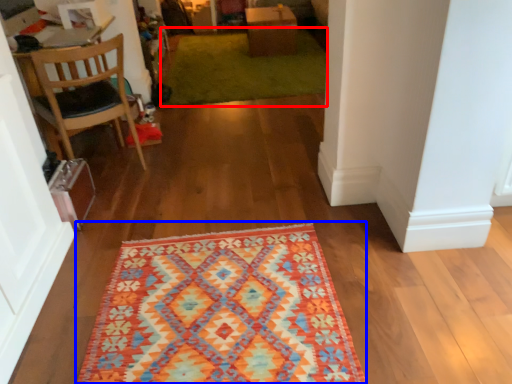
Question: Which object is further to the camera taking this photo, doormat (highlighted by a red box) or mat (highlighted by a blue box)?

Choices:
 (A) doormat
 (B) mat

Answer: (A)